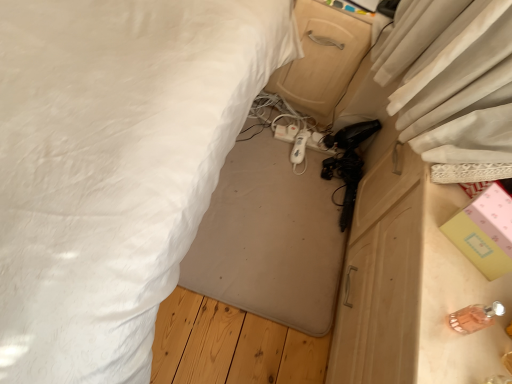
In order to click on vacant area to the left of white matte remote control at center, positioned as the 2th equipment in right-to-left order in this screenshot , I will do `click(263, 132)`.